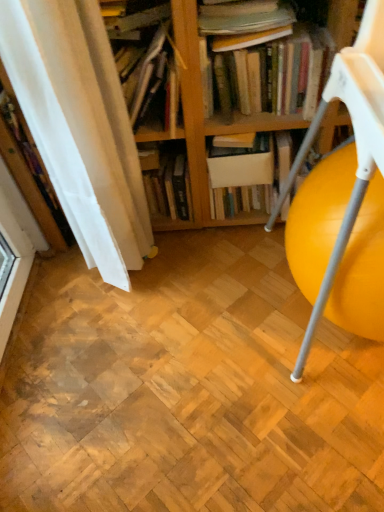
Question: Based on their sizes in the image, would you say white matte book at center is bigger or smaller than white fabric curtain at left?

Choices:
 (A) small
 (B) big

Answer: (A)

Question: Is point (246, 177) closer or farther from the camera than point (56, 118)?

Choices:
 (A) closer
 (B) farther

Answer: (B)

Question: Which is nearer to the yellow plastic ball at right?

Choices:
 (A) white fabric curtain at left
 (B) hardcover books at upper center, the first book viewed from the right
 (C) hardcover book at center, the 2th book when ordered from left to right
 (D) white matte book at center
 (E) wooden bookshelf at upper center, positioned as the third book in right-to-left order

Answer: (B)

Question: Based on their relative distances, which object is nearer to the wooden bookshelf at upper center, placed as the first book when sorted from left to right?

Choices:
 (A) white matte book at center
 (B) hardcover book at center, which appears as the second book when viewed from the right
 (C) white fabric curtain at left
 (D) yellow plastic ball at right
 (E) hardcover books at upper center, the first book viewed from the right

Answer: (C)